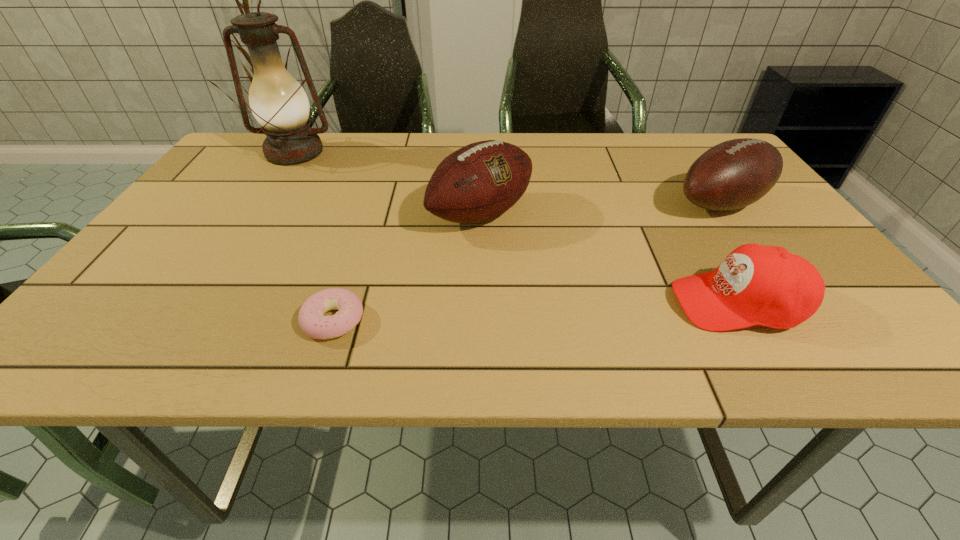
Locate an element on the screen. The image size is (960, 540). vacant space that satisfies the following two spatial constraints: 1. on the back side of the third object from right to left; 2. on the left side of the fourth object from right to left is located at coordinates (368, 214).